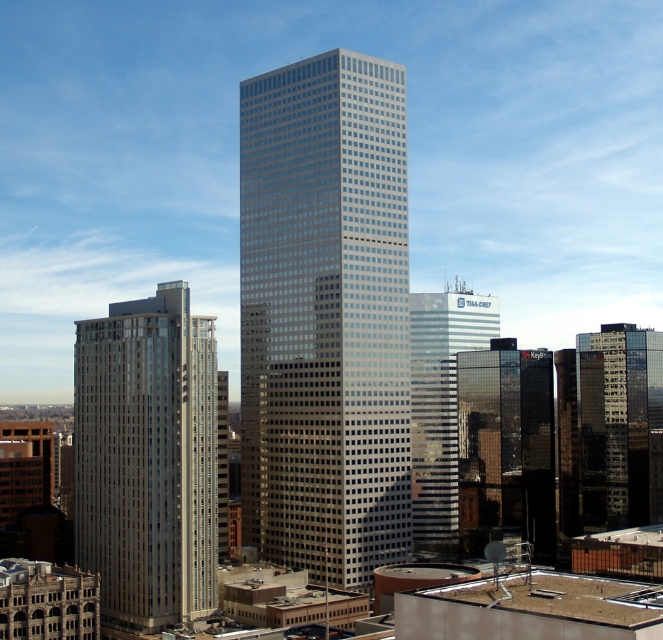
Question: Which of the following is the farthest from the observer?

Choices:
 (A) (269, 88)
 (B) (518, 440)
 (C) (638, 465)

Answer: (C)

Question: Does glassy silver skyscraper at center have a smaller size compared to silver glass building at left?

Choices:
 (A) no
 (B) yes

Answer: (A)

Question: Can you confirm if silver glass building at left is thinner than silver reflective glass skyscraper at center?

Choices:
 (A) yes
 (B) no

Answer: (A)

Question: Based on their relative distances, which object is nearer to the shiny black glass building at center?

Choices:
 (A) shiny glass skyscraper at right
 (B) silver glass building at left
 (C) silver reflective glass skyscraper at center
 (D) glassy silver skyscraper at center

Answer: (C)

Question: Does silver glass building at left appear over silver reflective glass skyscraper at center?

Choices:
 (A) yes
 (B) no

Answer: (B)

Question: Among these points, which one is nearest to the camera?

Choices:
 (A) (160, 355)
 (B) (410, 374)
 (C) (477, 435)
 (D) (385, 180)

Answer: (A)